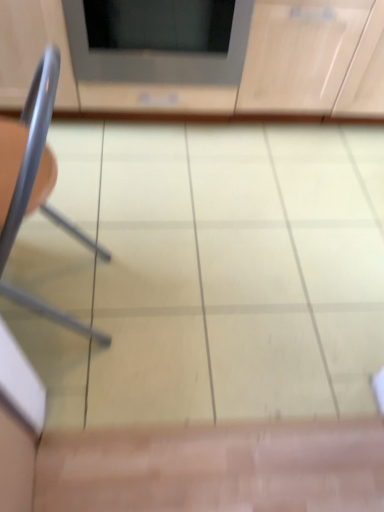
Question: From a real-world perspective, is metallic gray chair at left above or below matte gray microwave at upper center?

Choices:
 (A) above
 (B) below

Answer: (A)

Question: Is metallic gray chair at left taller or shorter than matte gray microwave at upper center?

Choices:
 (A) tall
 (B) short

Answer: (A)

Question: Estimate the real-world distances between objects in this image. Which object is closer to the metallic gray chair at left?

Choices:
 (A) matte gray microwave at upper center
 (B) matte wood cabinet at upper center

Answer: (A)

Question: Which is nearer to the metallic gray chair at left?

Choices:
 (A) matte gray microwave at upper center
 (B) matte wood cabinet at upper center

Answer: (A)